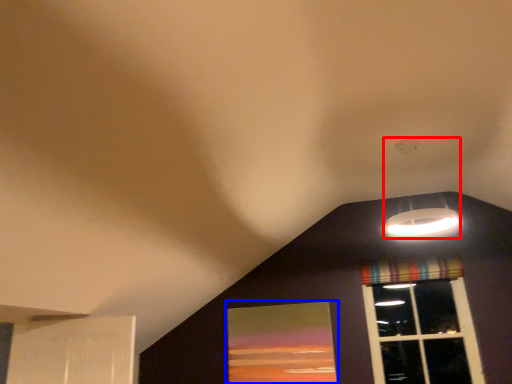
Question: Which of the following is the farthest to the observer, lamp (highlighted by a red box) or window screen (highlighted by a blue box)?

Choices:
 (A) lamp
 (B) window screen

Answer: (B)